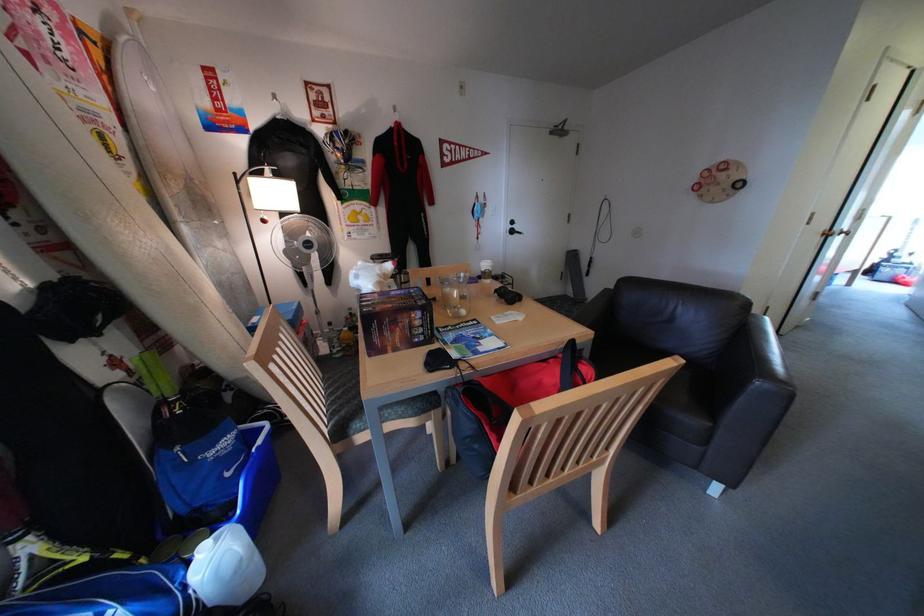
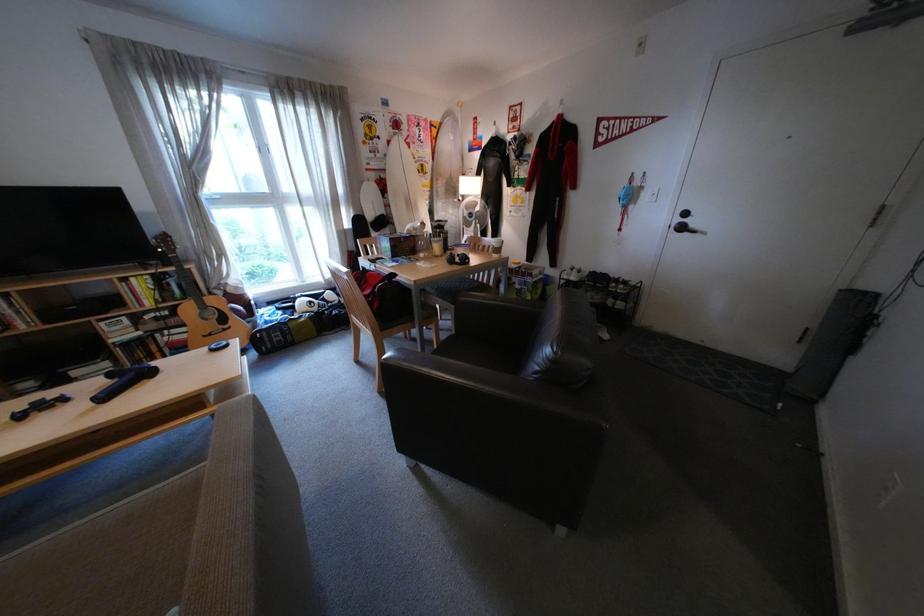
The point at (95, 75) is marked in the first image. Where is the corresponding point in the second image?

(439, 145)